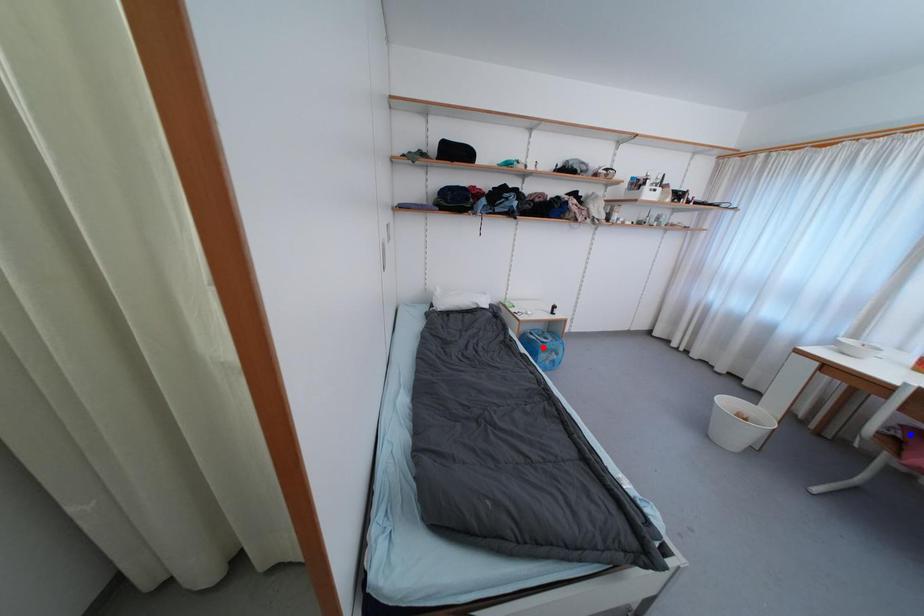
Question: Which of the two points in the image is closer to the camera?

Choices:
 (A) Blue point is closer.
 (B) Red point is closer.

Answer: (A)